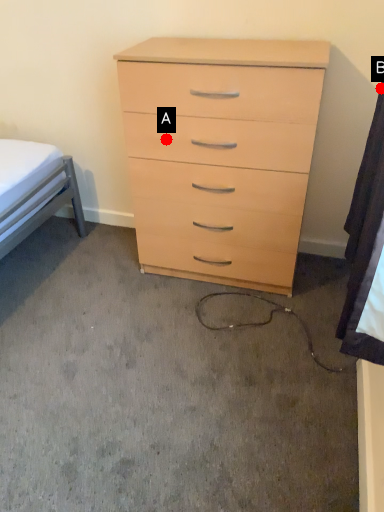
Question: Two points are circled on the image, labeled by A and B beside each circle. Which point is closer to the camera?

Choices:
 (A) A is closer
 (B) B is closer

Answer: (B)